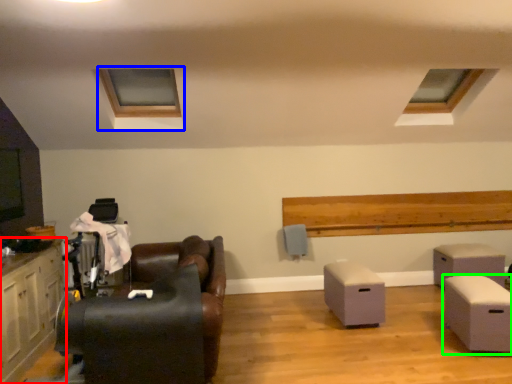
Question: Which object is positioned closest to cabinetry (highlighted by a red box)? Select from window frame (highlighted by a blue box) and table (highlighted by a green box).

Choices:
 (A) window frame
 (B) table

Answer: (A)